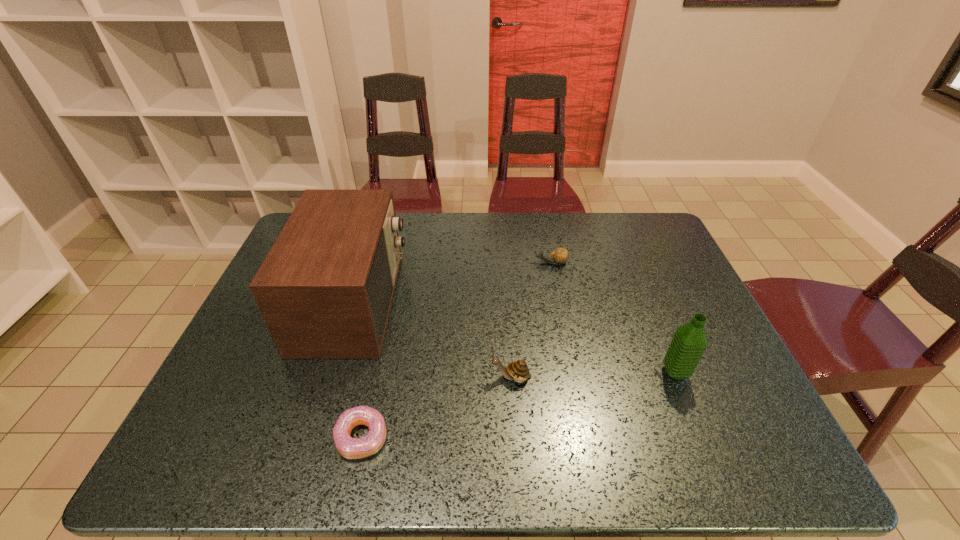
This screenshot has height=540, width=960. What are the coordinates of `radio receiver` in the screenshot? It's located at (325, 289).

Identify the location of water bottle. The image size is (960, 540). (689, 342).

The height and width of the screenshot is (540, 960). I want to click on the fourth shortest object, so click(x=689, y=342).

This screenshot has height=540, width=960. I want to click on the third shortest object, so click(518, 371).

The width and height of the screenshot is (960, 540). What are the coordinates of `the taller escargot` in the screenshot? It's located at pyautogui.click(x=518, y=371).

Identify the location of the right escargot. The height and width of the screenshot is (540, 960). (560, 255).

You are a GUI agent. You are given a task and a screenshot of the screen. Output one action in this format:
    pyautogui.click(x=<x>, y=<y>)
    Task: Click on the shorter escargot
    Image resolution: width=960 pixels, height=540 pixels.
    Given the screenshot: What is the action you would take?
    pyautogui.click(x=560, y=255)

Identify the location of the nearest object. (350, 448).

Where is `the shortest object`? This screenshot has width=960, height=540. the shortest object is located at coordinates (350, 448).

Where is `vacant space situated on the front-facing side of the radio receiver`? The height and width of the screenshot is (540, 960). vacant space situated on the front-facing side of the radio receiver is located at coordinates (452, 302).